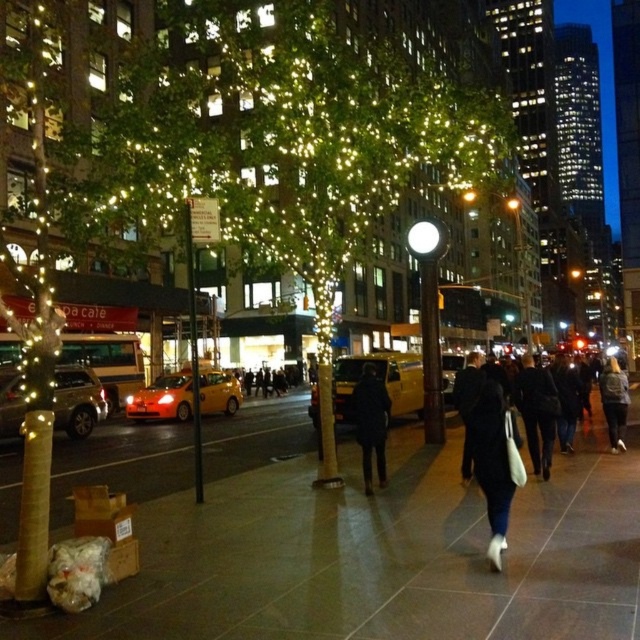
Does black fabric bag at center lie behind black leather coat at center?

No, it is in front of black leather coat at center.

Which of these two, black fabric bag at center or black leather coat at center, stands shorter?

black leather coat at center

Is point (481, 458) closer to viewer compared to point (545, 451)?

Yes, point (481, 458) is in front of point (545, 451).

You are a GUI agent. You are given a task and a screenshot of the screen. Output one action in this format:
    pyautogui.click(x=<x>, y=<y>)
    Task: Click on the black fabric bag at center
    The width and height of the screenshot is (640, 640).
    Given the screenshot: What is the action you would take?
    pyautogui.click(x=484, y=445)

Between black leather coat at center and dark gray jacket at lower right, which one appears on the right side from the viewer's perspective?

From the viewer's perspective, dark gray jacket at lower right appears more on the right side.

Does black leather coat at center have a smaller size compared to dark gray jacket at lower right?

Yes.

Is point (540, 472) positioned before point (611, 394)?

That is True.

The image size is (640, 640). Identify the location of black leather coat at center. [x=536, y=412].

Can you confirm if dark blue coat at center is positioned above dark gray jacket at lower right?

Yes, dark blue coat at center is above dark gray jacket at lower right.

Between point (365, 388) and point (605, 397), which one is positioned behind?

The point (605, 397) is more distant.

This screenshot has width=640, height=640. I want to click on dark blue coat at center, so click(x=371, y=422).